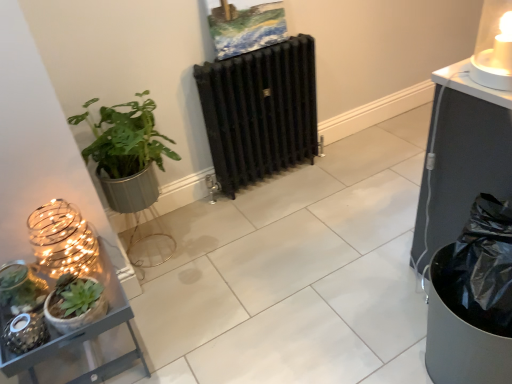
Describe the element at coordinates (260, 111) in the screenshot. This screenshot has height=384, width=512. I see `black cast iron radiator at center` at that location.

At what (x,y) coordinates should I click in order to perform the action: click on green matte plant at left, which is counted as the 2th houseplant, starting from the front. Please return your answer as a coordinate pair (x, y). This screenshot has height=384, width=512. Looking at the image, I should click on (127, 154).

What is the approximate height of translucent glass candle at upper right, marked as the 2th candle holder in a bottom-to-top arrangement?

It is 24.96 centimeters.

What is the approximate height of metallic gray shelf at lower left?

17.13 inches.

What do you see at coordinates (62, 239) in the screenshot? Image resolution: width=512 pixels, height=384 pixels. I see `matte gold wire candle holder at left, the 1th candle holder in the left-to-right sequence` at bounding box center [62, 239].

You are a GUI agent. You are given a task and a screenshot of the screen. Output one action in this format:
    pyautogui.click(x=<x>, y=<y>)
    Task: Click on the black cast iron radiator at center
    This screenshot has height=384, width=512.
    Given the screenshot: What is the action you would take?
    pyautogui.click(x=260, y=111)

Which point is more distant from viewer, (506, 9) or (106, 118)?

The point (506, 9) is farther.

Considering the relative sizes of translucent glass candle at upper right, which is the first candle holder in right-to-left order, and green matte plant at left, the 1th houseplant when ordered from back to front, in the image provided, is translucent glass candle at upper right, which is the first candle holder in right-to-left order, wider than green matte plant at left, the 1th houseplant when ordered from back to front,?

In fact, translucent glass candle at upper right, which is the first candle holder in right-to-left order, might be narrower than green matte plant at left, the 1th houseplant when ordered from back to front.

Is translucent glass candle at upper right, which appears as the 1th candle holder when viewed from the top, to the left of green matte plant at left, the 1th houseplant when ordered from back to front, from the viewer's perspective?

Incorrect, translucent glass candle at upper right, which appears as the 1th candle holder when viewed from the top, is not on the left side of green matte plant at left, the 1th houseplant when ordered from back to front.

From a real-world perspective, which is physically below, green matte succulent at lower left or metallic gray shelf at lower left?

metallic gray shelf at lower left is physically lower.

Based on the photo, considering the relative positions of green matte succulent at lower left and metallic gray shelf at lower left in the image provided, is green matte succulent at lower left to the right of metallic gray shelf at lower left from the viewer's perspective?

In fact, green matte succulent at lower left is to the left of metallic gray shelf at lower left.

Which object is thinner, green matte succulent at lower left or metallic gray shelf at lower left?

green matte succulent at lower left.

Are green matte succulent at lower left and metallic gray shelf at lower left far apart?

No, green matte succulent at lower left is not far away from metallic gray shelf at lower left.

Considering the points (505, 54) and (88, 316), which point is behind, point (505, 54) or point (88, 316)?

Point (505, 54)

Is translucent glass candle at upper right, which is the first candle holder in right-to-left order, situated inside metallic gray shelf at lower left or outside?

translucent glass candle at upper right, which is the first candle holder in right-to-left order, exists outside the volume of metallic gray shelf at lower left.

From a real-world perspective, relative to black cast iron radiator at center, is matte gold wire candle holder at left, the 2th candle holder positioned from the right, vertically above or below?

Clearly, from a real-world perspective, matte gold wire candle holder at left, the 2th candle holder positioned from the right, is above black cast iron radiator at center.

From the picture: From the image's perspective, is matte gold wire candle holder at left, the 2th candle holder from the top, under black cast iron radiator at center?

Indeed, from the image's perspective, matte gold wire candle holder at left, the 2th candle holder from the top, is shown beneath black cast iron radiator at center.

Which of these two, matte gold wire candle holder at left, the 2th candle holder from the top, or black cast iron radiator at center, is wider?

matte gold wire candle holder at left, the 2th candle holder from the top, is wider.

Based on the photo, could green matte succulent at lower left, placed as the first houseplant when sorted from front to back, be considered to be inside green matte plant at left, which is counted as the 2th houseplant, starting from the front?

No, green matte succulent at lower left, placed as the first houseplant when sorted from front to back, is not inside green matte plant at left, which is counted as the 2th houseplant, starting from the front.

Does green matte plant at left, the 1th houseplant when ordered from back to front, have a lesser height compared to green matte succulent at lower left, which is the 2th houseplant in back-to-front order?

No.

You are a GUI agent. You are given a task and a screenshot of the screen. Output one action in this format:
    pyautogui.click(x=<x>, y=<y>)
    Task: Click on the houseplant in front of the green matte plant at left, which is counted as the 2th houseplant, starting from the front
    This screenshot has width=512, height=384.
    Given the screenshot: What is the action you would take?
    pyautogui.click(x=76, y=305)

Is green matte plant at left, which is counted as the 2th houseplant, starting from the front, directly adjacent to green matte succulent at lower left, which is the 2th houseplant in back-to-front order?

No, green matte plant at left, which is counted as the 2th houseplant, starting from the front, is not next to green matte succulent at lower left, which is the 2th houseplant in back-to-front order.

Considering the positions of objects translucent glass candle at upper right, which appears as the 1th candle holder when viewed from the top, and green matte succulent at lower left in the image provided, who is more to the right, translucent glass candle at upper right, which appears as the 1th candle holder when viewed from the top, or green matte succulent at lower left?

translucent glass candle at upper right, which appears as the 1th candle holder when viewed from the top, is more to the right.

Can you confirm if translucent glass candle at upper right, which is the first candle holder in right-to-left order, is shorter than green matte succulent at lower left?

Incorrect, the height of translucent glass candle at upper right, which is the first candle holder in right-to-left order, does not fall short of that of green matte succulent at lower left.

Is translucent glass candle at upper right, marked as the 2th candle holder in a bottom-to-top arrangement, next to green matte succulent at lower left?

There is a gap between translucent glass candle at upper right, marked as the 2th candle holder in a bottom-to-top arrangement, and green matte succulent at lower left.

Does translucent glass candle at upper right, the second candle holder when ordered from left to right, have a greater width compared to green matte succulent at lower left?

Correct, the width of translucent glass candle at upper right, the second candle holder when ordered from left to right, exceeds that of green matte succulent at lower left.

Considering the positions of points (54, 254) and (73, 306), is point (54, 254) farther from camera compared to point (73, 306)?

Yes, it is behind point (73, 306).

Is metallic gray shelf at lower left oriented away from green matte succulent at lower left, which is the 2th houseplant in back-to-front order?

No.

You are a GUI agent. You are given a task and a screenshot of the screen. Output one action in this format:
    pyautogui.click(x=<x>, y=<y>)
    Task: Click on the 1st houseplant behind when counting from the metallic gray shelf at lower left
    
    Given the screenshot: What is the action you would take?
    pyautogui.click(x=76, y=305)

From the image's perspective, count 1st houseplants downward from the translucent glass candle at upper right, which is the first candle holder in right-to-left order, and point to it. Please provide its 2D coordinates.

[(127, 154)]

Identify the location of shelf that is under the green matte succulent at lower left (from a real-world perspective). (53, 290).

Estimate the real-world distances between objects in this image. Which object is closer to green matte succulent at lower left, which is the 2th houseplant in back-to-front order, metallic gray shelf at lower left or translucent glass candle at upper right, which appears as the 1th candle holder when viewed from the top?

metallic gray shelf at lower left is positioned closer to the anchor green matte succulent at lower left, which is the 2th houseplant in back-to-front order.

Which object lies further to the anchor point black cast iron radiator at center, green matte plant at left, the 1th houseplant when ordered from back to front, or green matte succulent at lower left, placed as the first houseplant when sorted from front to back?

green matte succulent at lower left, placed as the first houseplant when sorted from front to back.

When comparing their distances from green matte plant at left, which is counted as the 2th houseplant, starting from the front, does green matte succulent at lower left, placed as the first houseplant when sorted from front to back, or green matte succulent at lower left seem further?

green matte succulent at lower left, placed as the first houseplant when sorted from front to back, is further to green matte plant at left, which is counted as the 2th houseplant, starting from the front.

From the image, which object appears to be nearer to green matte succulent at lower left, metallic gray shelf at lower left or black cast iron radiator at center?

metallic gray shelf at lower left lies closer to green matte succulent at lower left than the other object.

Which object lies further to the anchor point black cast iron radiator at center, metallic gray shelf at lower left or matte gold wire candle holder at left, the 2th candle holder positioned from the right?

Based on the image, metallic gray shelf at lower left appears to be further to black cast iron radiator at center.

Considering their positions, is green matte succulent at lower left, placed as the first houseplant when sorted from front to back, positioned closer to matte gold wire candle holder at left, the 2th candle holder from the top, than green matte succulent at lower left?

green matte succulent at lower left lies closer to matte gold wire candle holder at left, the 2th candle holder from the top, than the other object.

Which object lies nearer to the anchor point matte gold wire candle holder at left, the 1th candle holder in the left-to-right sequence, metallic gray shelf at lower left or black cast iron radiator at center?

Among the two, metallic gray shelf at lower left is located nearer to matte gold wire candle holder at left, the 1th candle holder in the left-to-right sequence.

Looking at the image, which one is located closer to black cast iron radiator at center, metallic gray shelf at lower left or green matte succulent at lower left, placed as the first houseplant when sorted from front to back?

metallic gray shelf at lower left is closer to black cast iron radiator at center.

Where is `houseplant between green matte plant at left, which is counted as the 2th houseplant, starting from the front, and metallic gray shelf at lower left from top to bottom`? houseplant between green matte plant at left, which is counted as the 2th houseplant, starting from the front, and metallic gray shelf at lower left from top to bottom is located at coordinates (76, 305).

This screenshot has width=512, height=384. What are the coordinates of `candle holder between black cast iron radiator at center and metallic gray shelf at lower left from top to bottom` in the screenshot? It's located at (62, 239).

Locate an element on the screen. This screenshot has height=384, width=512. vegetation between black cast iron radiator at center and green matte succulent at lower left, which is the 2th houseplant in back-to-front order, from top to bottom is located at coordinates (21, 289).

This screenshot has height=384, width=512. I want to click on radiator situated between green matte succulent at lower left and translucent glass candle at upper right, marked as the 2th candle holder in a bottom-to-top arrangement, from left to right, so click(x=260, y=111).